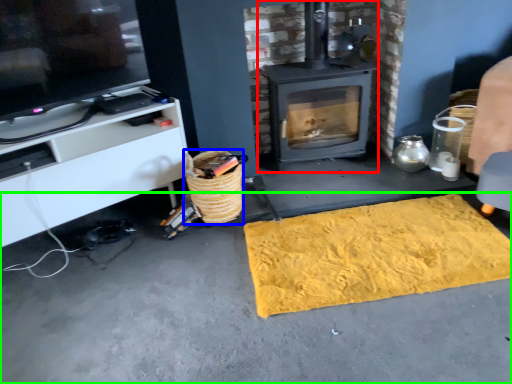
Question: Which is nearer to the wood burning stove (highlighted by a red box)? basket (highlighted by a blue box) or concrete (highlighted by a green box).

Choices:
 (A) basket
 (B) concrete

Answer: (A)